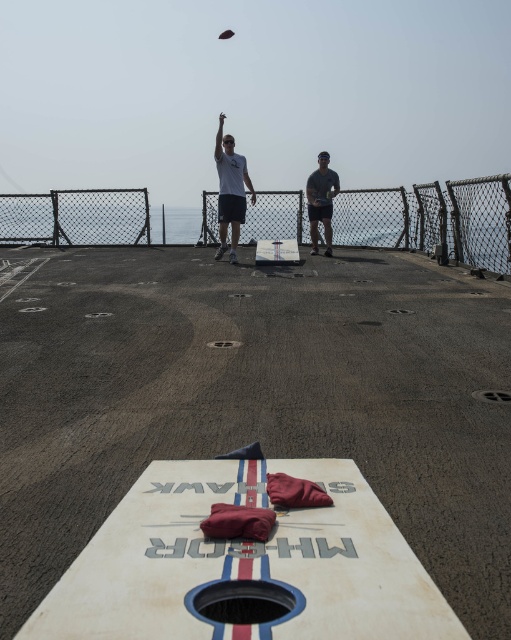
Who is higher up, white matte t-shirt at upper center or dark gray fabric at center?

Positioned higher is white matte t-shirt at upper center.

Does white matte t-shirt at upper center come behind dark gray fabric at center?

That is False.

Who is more distant from viewer, (219, 179) or (312, 248)?

The point (312, 248) is more distant.

Locate an element on the screen. white matte t-shirt at upper center is located at coordinates (229, 189).

Does white matte t-shirt at upper center have a greater width compared to dark brown wooden frisbee at upper center?

Indeed, white matte t-shirt at upper center has a greater width compared to dark brown wooden frisbee at upper center.

Between white matte t-shirt at upper center and dark brown wooden frisbee at upper center, which one has more height?

With more height is dark brown wooden frisbee at upper center.

Is point (222, 148) less distant than point (227, 36)?

No, it is behind (227, 36).

Find the location of a particular element. The width and height of the screenshot is (511, 640). white matte t-shirt at upper center is located at coordinates 229,189.

Is dark gray fabric at center bigger than dark brown wooden frisbee at upper center?

No.

Which is in front, point (331, 202) or point (224, 35)?

Positioned in front is point (331, 202).

Is point (324, 218) farther from viewer compared to point (225, 35)?

That is False.

Where is `dark gray fabric at center`? This screenshot has width=511, height=640. dark gray fabric at center is located at coordinates (321, 202).